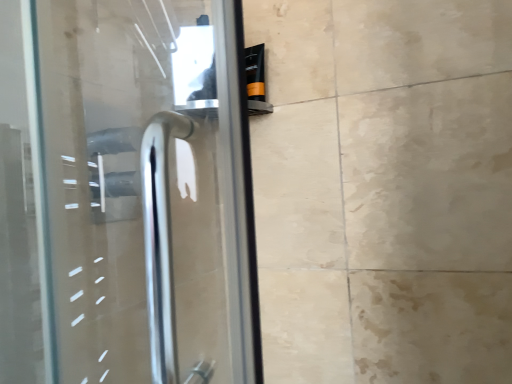
What do you see at coordinates (255, 72) in the screenshot? Image resolution: width=512 pixels, height=384 pixels. I see `black matte tube at upper center` at bounding box center [255, 72].

Identify the location of black matte tube at upper center. The width and height of the screenshot is (512, 384). (255, 72).

This screenshot has width=512, height=384. What are the coordinates of `black matte tube at upper center` in the screenshot? It's located at (255, 72).